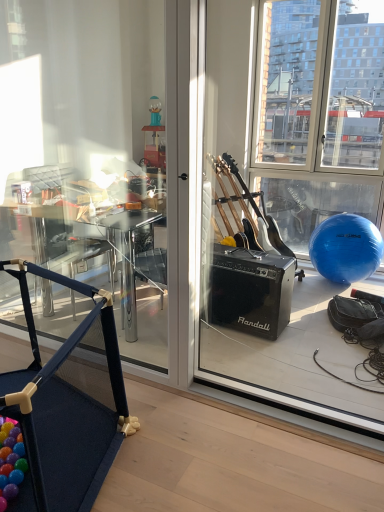
Identify the location of empty space that is ontop of wooden floor at lower left (from a real-world perspective). This screenshot has width=384, height=512. (197, 446).